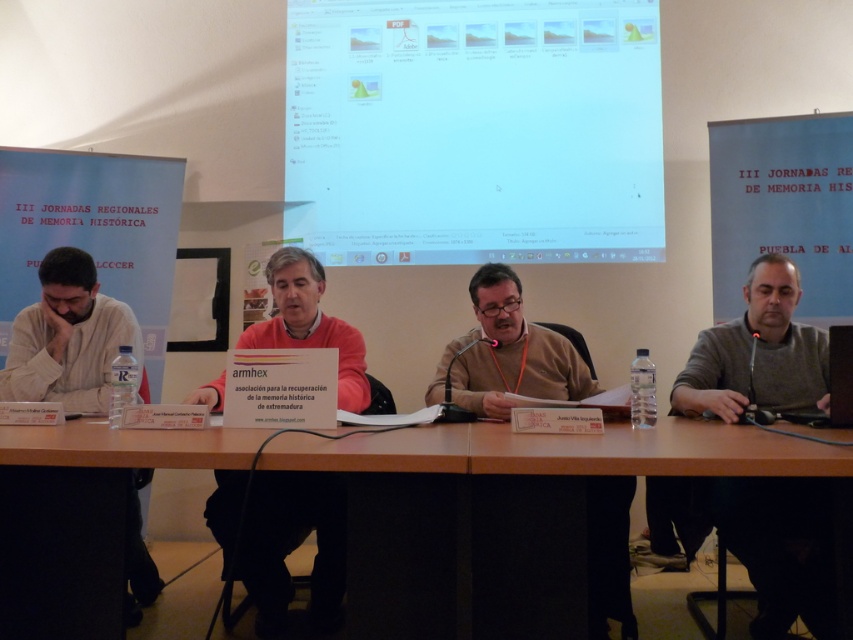
Question: Among these points, which one is farthest from the camera?

Choices:
 (A) (281, 563)
 (B) (653, 257)
 (C) (141, 381)
 (D) (273, 448)

Answer: (B)

Question: Estimate the real-world distances between objects in this image. Which object is farther from the white glossy screen at upper center?

Choices:
 (A) matte black sweater at left
 (B) white paper at upper center

Answer: (A)

Question: Is pink fabric shirt at center further to camera compared to matte black sweater at left?

Choices:
 (A) no
 (B) yes

Answer: (A)

Question: Which point is closer to the camera taking this photo?

Choices:
 (A) (30, 339)
 (B) (405, 76)
 (C) (839, 168)
 (D) (326, 332)

Answer: (D)

Question: Can you confirm if brown wooden table at center is positioned below white paper at upper center?

Choices:
 (A) no
 (B) yes

Answer: (B)

Question: Does brown wooden table at center have a greater width compared to brown sweater at center?

Choices:
 (A) no
 (B) yes

Answer: (B)